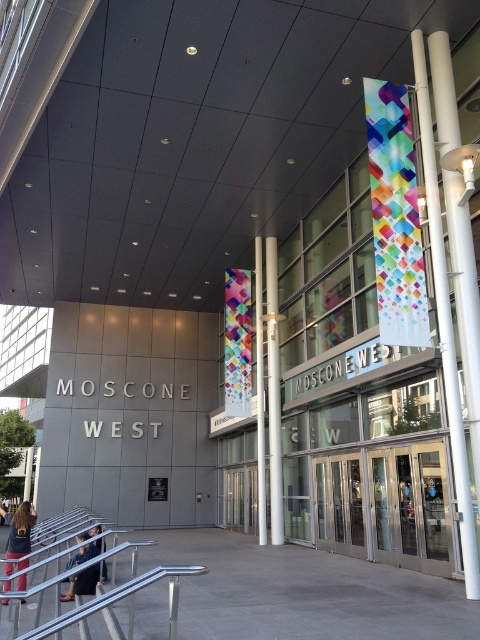
Question: Considering the relative positions of transparent glass doors at center and denim jacket at lower left in the image provided, where is transparent glass doors at center located with respect to denim jacket at lower left?

Choices:
 (A) left
 (B) right

Answer: (B)

Question: Is transparent glass doors at center in front of white glossy pillar at center?

Choices:
 (A) no
 (B) yes

Answer: (B)

Question: Is dark blue jeans at lower left thinner than dark blue jacket at lower left?

Choices:
 (A) no
 (B) yes

Answer: (A)

Question: Which object is farther from the camera taking this photo?

Choices:
 (A) white glossy pillar at center
 (B) denim jacket at lower left

Answer: (A)

Question: Which point appears closest to the camera in this image?

Choices:
 (A) (106, 570)
 (B) (85, 554)
 (C) (24, 602)
 (D) (331, 547)

Answer: (C)

Question: Estimate the real-world distances between objects in this image. Which object is closer to the transparent glass doors at center?

Choices:
 (A) white glossy pole at center
 (B) dark blue jacket at lower left

Answer: (A)